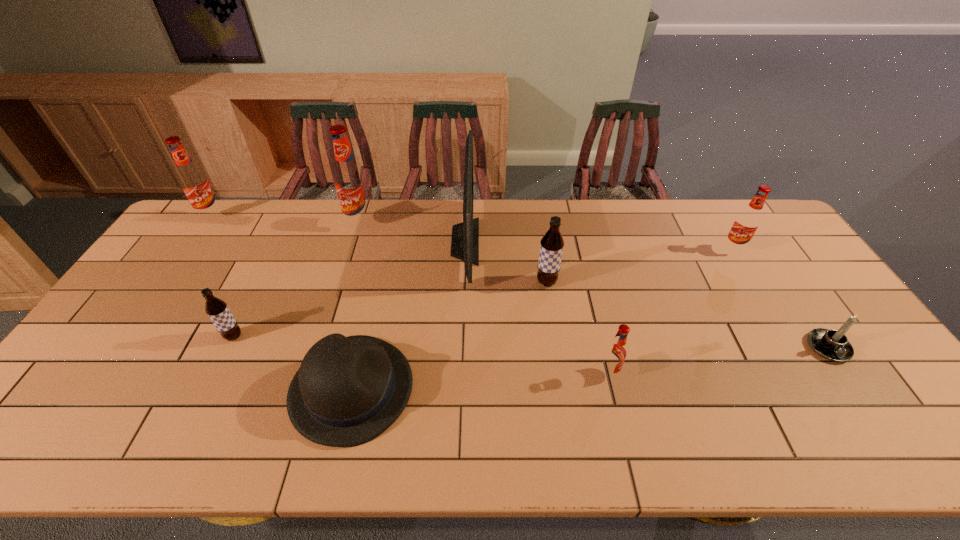
Identify which red root beer is the third nearest to the fifth object from left to right. Please provide its 2D coordinates. Your answer should be formatted as a tuple, i.e. [(x, y)], where the tuple contains the x and y coordinates of a point satisfying the conditions above.

[(747, 222)]

Locate an element on the screen. Image resolution: width=960 pixels, height=540 pixels. vacant space that satisfies the following two spatial constraints: 1. on the screen side of the fourth root beer from left to right; 2. on the right side of the fifth object from left to right is located at coordinates (464, 282).

Identify the location of free spot that satisfies the following two spatial constraints: 1. on the screen side of the monitor; 2. on the right side of the nearest root beer. This screenshot has height=540, width=960. (461, 373).